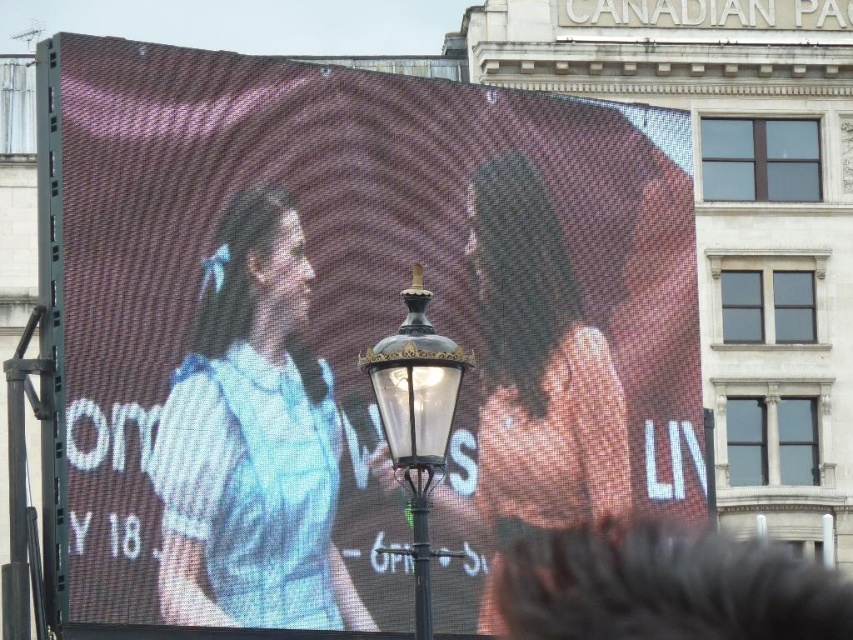
Can you confirm if pixelated digital billboard at center is thinner than smooth skin face at center?

No.

Looking at this image, how far apart are pixelated digital billboard at center and smooth skin face at center?

pixelated digital billboard at center is 2.62 meters from smooth skin face at center.

The image size is (853, 640). In order to click on pixelated digital billboard at center in this screenshot , I will do `click(345, 330)`.

Does blue cotton shirt at left lie in front of smooth skin face at center?

Yes, it is in front of smooth skin face at center.

Measure the distance between blue cotton shirt at left and smooth skin face at center.

blue cotton shirt at left is 8.79 meters away from smooth skin face at center.

Is point (238, 323) positioned after point (477, 291)?

No, it is not.

I want to click on blue cotton shirt at left, so click(x=252, y=442).

Which is more to the right, blue cotton shirt at left or polished brass streetlight at center?

polished brass streetlight at center

How distant is blue cotton shirt at left from polished brass streetlight at center?

The distance of blue cotton shirt at left from polished brass streetlight at center is 9.72 meters.

What do you see at coordinates (252, 442) in the screenshot?
I see `blue cotton shirt at left` at bounding box center [252, 442].

You are a GUI agent. You are given a task and a screenshot of the screen. Output one action in this format:
    pyautogui.click(x=<x>, y=<y>)
    Task: Click on the blue cotton shirt at left
    
    Given the screenshot: What is the action you would take?
    click(252, 442)